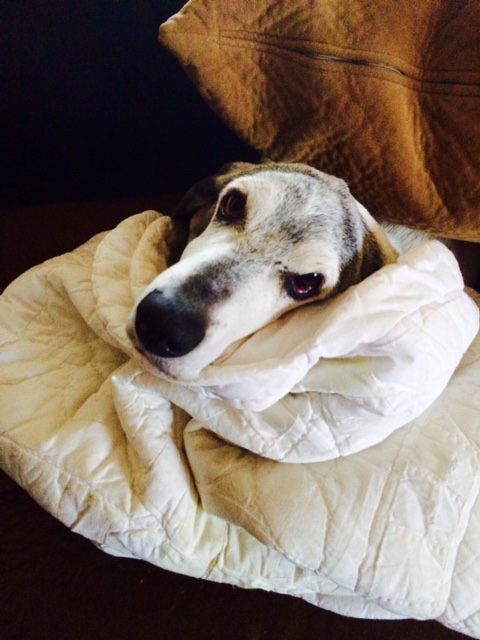
You are a GUI agent. You are given a task and a screenshot of the screen. Output one action in this format:
    pyautogui.click(x=<x>, y=<y>)
    Task: Click on the blanket
    The width and height of the screenshot is (480, 640).
    Given the screenshot: What is the action you would take?
    pyautogui.click(x=347, y=386)